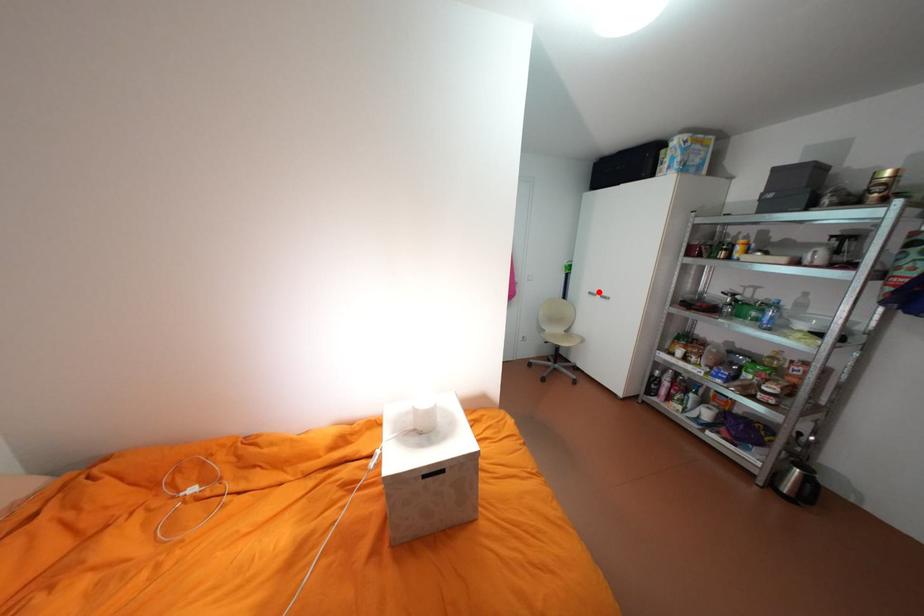
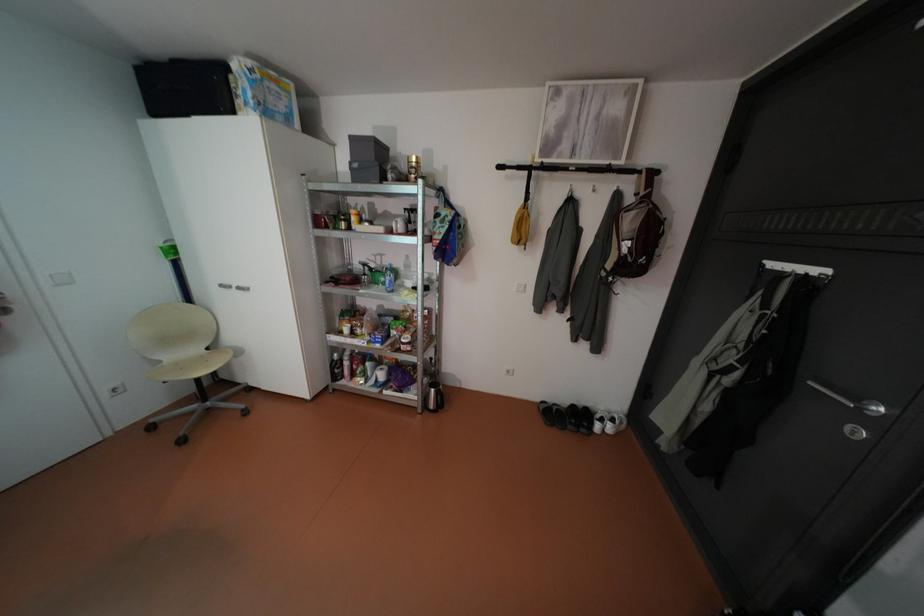
Question: A red point is marked in image1. In image2, is the corresponding 3D point closer to the camera or farther? Reply with the corresponding letter.

Choices:
 (A) The corresponding 3D point is closer.
 (B) The corresponding 3D point is farther.

Answer: (B)